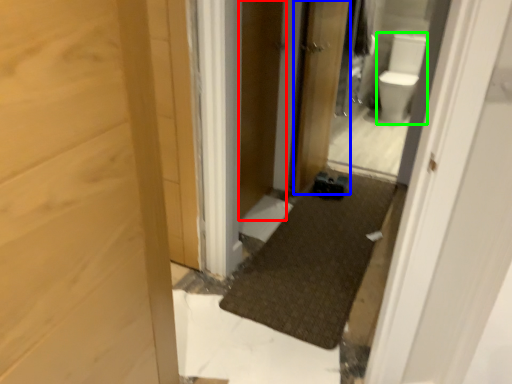
Question: Which is nearer to the screen door (highlighted by a red box)? door (highlighted by a blue box) or toilet bowl (highlighted by a green box).

Choices:
 (A) door
 (B) toilet bowl

Answer: (A)